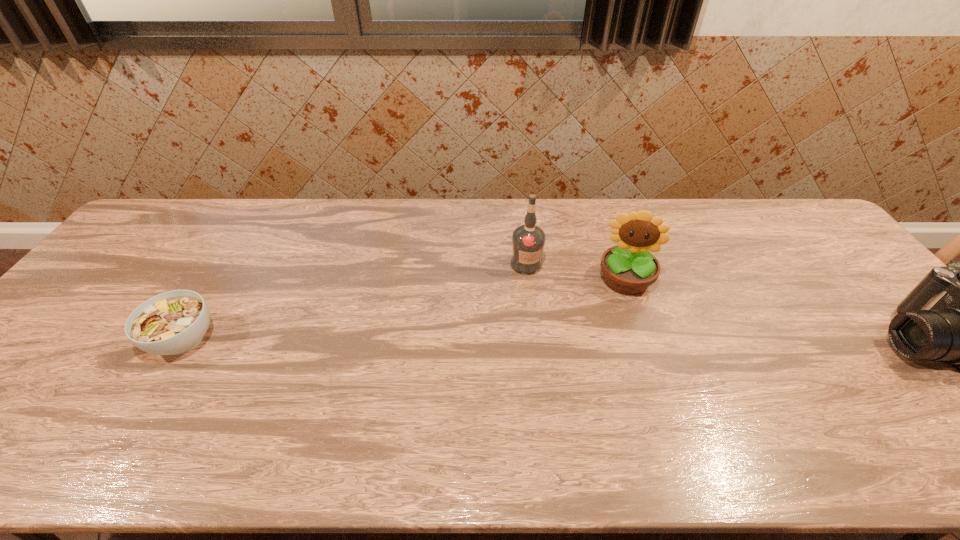
The image size is (960, 540). Find the location of `soup bowl`. soup bowl is located at coordinates (172, 323).

At what (x,y) coordinates should I click in order to perform the action: click on the shortest object. Please return your answer as a coordinate pair (x, y). This screenshot has width=960, height=540. Looking at the image, I should click on (172, 323).

Where is `vodka`? vodka is located at coordinates (528, 240).

You are a GUI agent. You are given a task and a screenshot of the screen. Output one action in this format:
    pyautogui.click(x=<x>, y=<y>)
    Task: Click on the sunflower
    This screenshot has width=960, height=540.
    Given the screenshot: What is the action you would take?
    pyautogui.click(x=629, y=268)

Where is `vacant space situated 0.090m on the front of the soup bowl`? This screenshot has width=960, height=540. vacant space situated 0.090m on the front of the soup bowl is located at coordinates (146, 402).

You are a GUI agent. You are given a task and a screenshot of the screen. Output one action in this format:
    pyautogui.click(x=<x>, y=<y>)
    Task: Click on the free space located on the front label of the third object from right to left
    The height and width of the screenshot is (540, 960).
    Given the screenshot: What is the action you would take?
    pyautogui.click(x=615, y=364)

Find the location of a particular element. The image size is (960, 540). vacant space located on the front label of the third object from right to left is located at coordinates (553, 293).

Locate an element on the screen. The height and width of the screenshot is (540, 960). vacant space located on the front label of the third object from right to left is located at coordinates (557, 298).

Identify the location of free spot located on the face of the sunflower. (617, 395).

You are a GUI agent. You are given a task and a screenshot of the screen. Output one action in this format:
    pyautogui.click(x=<x>, y=<y>)
    Task: Click on the free space located 0.160m on the face of the sunflower
    
    Given the screenshot: What is the action you would take?
    pyautogui.click(x=620, y=344)